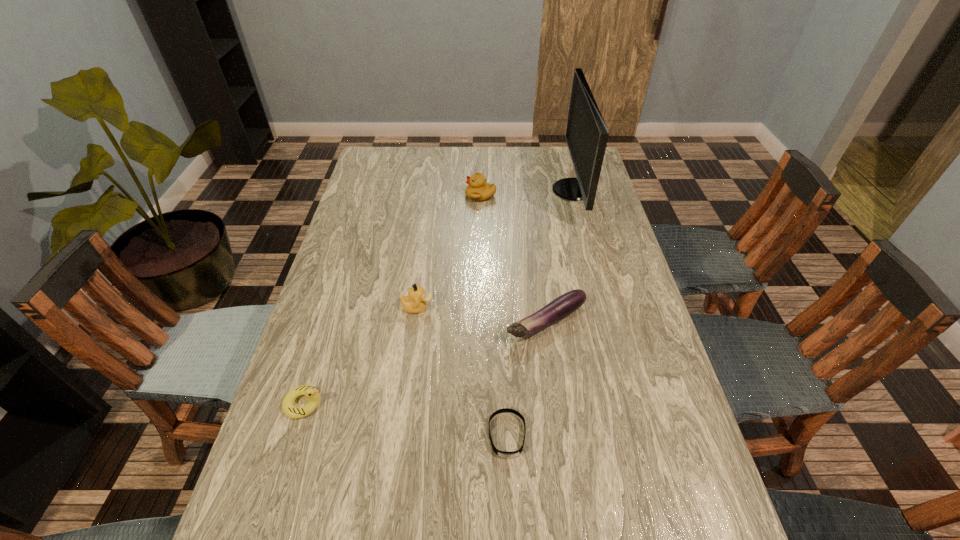
Identify the location of computer monitor. The width and height of the screenshot is (960, 540). (586, 135).

At what (x,y) coordinates should I click in order to perform the action: click on the rightmost duckling. Please return your answer as a coordinate pair (x, y). Looking at the image, I should click on (478, 189).

Where is `the second duckling from left to right`? This screenshot has width=960, height=540. the second duckling from left to right is located at coordinates (415, 302).

The height and width of the screenshot is (540, 960). Find the location of `the second nearest duckling`. the second nearest duckling is located at coordinates (415, 302).

Find the location of `eggplant`. eggplant is located at coordinates (564, 305).

Identify the location of the nearest duckling. (312, 394).

The image size is (960, 540). In order to click on the leftmost object in this screenshot , I will do `click(312, 394)`.

Identify the location of wristband. (504, 454).

At what (x,y) coordinates should I click in order to perform the action: click on vacant space located on the front-facing side of the computer monitor. Please return your answer as a coordinate pair (x, y). This screenshot has width=960, height=540. Looking at the image, I should click on (444, 190).

The image size is (960, 540). I want to click on vacant space located 0.160m on the front-facing side of the computer monitor, so click(509, 190).